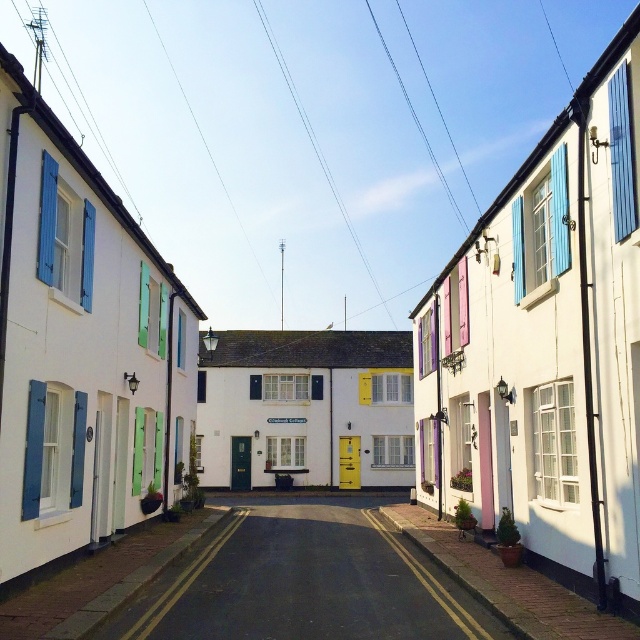
Which of these two, smooth asphalt road at center or white matte house at center, stands shorter?

smooth asphalt road at center

Between smooth asphalt road at center and white matte house at center, which one appears on the left side from the viewer's perspective?

Positioned to the left is white matte house at center.

Does point (388, 627) come behind point (394, 456)?

No, it is in front of (394, 456).

At what (x,y) coordinates should I click in order to perform the action: click on smooth asphalt road at center. Please return your answer as a coordinate pair (x, y). Image resolution: width=640 pixels, height=640 pixels. Looking at the image, I should click on (304, 582).

Is smooth asphalt road at center positioned before terracotta pot at lower right?

No, it is behind terracotta pot at lower right.

This screenshot has width=640, height=640. What do you see at coordinates (304, 582) in the screenshot?
I see `smooth asphalt road at center` at bounding box center [304, 582].

Who is more distant from viewer, (212, 577) or (611, 634)?

Point (212, 577)

The width and height of the screenshot is (640, 640). Find the location of `smooth asphalt road at center`. smooth asphalt road at center is located at coordinates (304, 582).

Does white matte house at center appear under terracotta pot at lower right?

No.

This screenshot has width=640, height=640. I want to click on white matte house at center, so click(x=305, y=408).

Between point (212, 358) and point (472, 541), which one is positioned in front?

Positioned in front is point (472, 541).

Find the location of a particular element. white matte house at center is located at coordinates (305, 408).